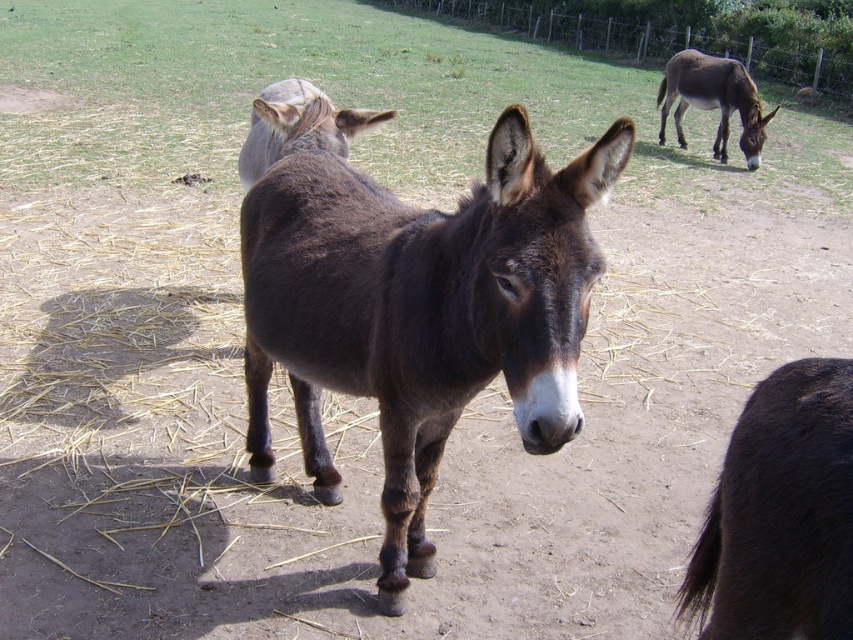
Looking at this image, is brown matte donkey at upper center further to camera compared to brown matte mule at upper right?

That is False.

Is brown matte donkey at upper center positioned in front of brown matte mule at upper right?

Yes, brown matte donkey at upper center is in front of brown matte mule at upper right.

Based on the photo, who is more distant from viewer, (299, 81) or (672, 81)?

Point (672, 81)

Find the location of a particular element. The image size is (853, 640). brown matte donkey at upper center is located at coordinates (299, 125).

Is dark brown fur at lower right below brown matte mule at upper right?

Yes, dark brown fur at lower right is below brown matte mule at upper right.

Between dark brown fur at lower right and brown matte mule at upper right, which one is positioned lower?

dark brown fur at lower right is below.

I want to click on dark brown fur at lower right, so click(781, 513).

Does dark brown fur at center have a lesser width compared to dark brown fur at lower right?

Incorrect, dark brown fur at center's width is not less than dark brown fur at lower right's.

Is dark brown fur at center positioned before dark brown fur at lower right?

No, dark brown fur at center is further to the viewer.

Identify the location of dark brown fur at center. (415, 300).

Identify the location of dark brown fur at center. This screenshot has width=853, height=640. (415, 300).